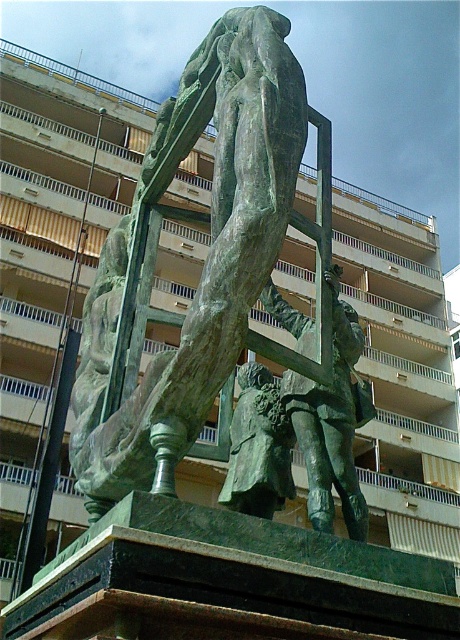
Question: Among these objects, which one is nearest to the camera?

Choices:
 (A) bronze sculpture at center
 (B) green patina statue at center

Answer: (A)

Question: Does bronze sculpture at center appear under green patina statue at center?

Choices:
 (A) no
 (B) yes

Answer: (A)

Question: Is bronze sculpture at center wider than green patina statue at center?

Choices:
 (A) yes
 (B) no

Answer: (A)

Question: Among these objects, which one is farthest from the camera?

Choices:
 (A) bronze sculpture at center
 (B) green patina statue at center

Answer: (B)

Question: Observing the image, what is the correct spatial positioning of bronze sculpture at center in reference to green patina statue at center?

Choices:
 (A) right
 (B) left

Answer: (B)